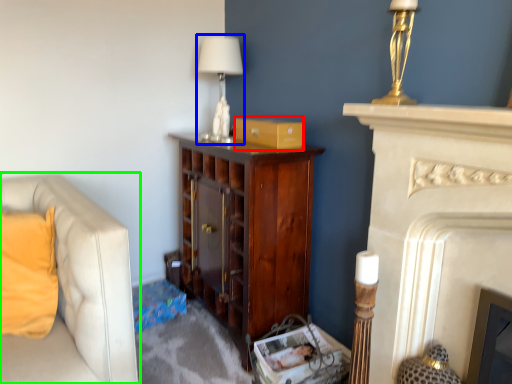
Question: Which is nearer to the cardboard box (highlighted by a red box)? table lamp (highlighted by a blue box) or studio couch (highlighted by a green box).

Choices:
 (A) table lamp
 (B) studio couch

Answer: (A)